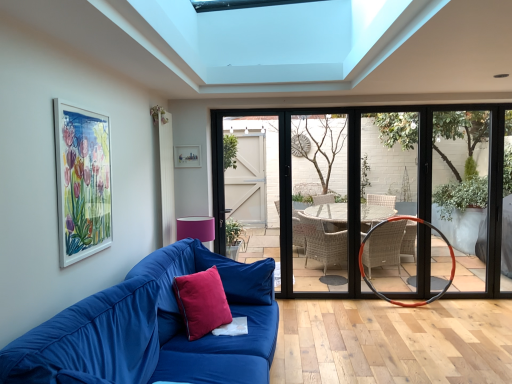
Question: Is velvet blue couch at lower left at the left side of velvet red pillow at lower left, which ranks as the 2th pillow in front-to-back order?

Choices:
 (A) no
 (B) yes

Answer: (B)

Question: Is velvet blue couch at lower left positioned in front of velvet red pillow at lower left, which ranks as the 2th pillow in front-to-back order?

Choices:
 (A) yes
 (B) no

Answer: (A)

Question: Is velvet blue couch at lower left to the right of velvet red pillow at lower left, positioned as the 1th pillow in back-to-front order, from the viewer's perspective?

Choices:
 (A) no
 (B) yes

Answer: (A)

Question: Is velvet blue couch at lower left surrounding velvet red pillow at lower left, which ranks as the 2th pillow in front-to-back order?

Choices:
 (A) yes
 (B) no

Answer: (A)

Question: Considering the relative sizes of velvet blue couch at lower left and velvet red pillow at lower left, positioned as the 1th pillow in back-to-front order, in the image provided, is velvet blue couch at lower left wider than velvet red pillow at lower left, positioned as the 1th pillow in back-to-front order,?

Choices:
 (A) no
 (B) yes

Answer: (B)

Question: Relative to velvet red pillow at lower left, positioned as the 1th pillow in back-to-front order, is satin red pillow at center, acting as the second pillow starting from the back, in front or behind?

Choices:
 (A) front
 (B) behind

Answer: (A)

Question: Is point (196, 306) closer or farther from the camera than point (239, 284)?

Choices:
 (A) closer
 (B) farther

Answer: (A)

Question: From the image's perspective, is satin red pillow at center, acting as the second pillow starting from the back, above or below velvet red pillow at lower left, positioned as the 1th pillow in back-to-front order?

Choices:
 (A) above
 (B) below

Answer: (B)

Question: Which is correct: satin red pillow at center, acting as the second pillow starting from the back, is inside velvet red pillow at lower left, which ranks as the 2th pillow in front-to-back order, or outside of it?

Choices:
 (A) outside
 (B) inside

Answer: (A)

Question: Does point (454, 261) appear closer or farther from the camera than point (189, 321)?

Choices:
 (A) closer
 (B) farther

Answer: (B)

Question: In terms of size, does orange rubber basketball hoop at right appear bigger or smaller than satin red pillow at center, acting as the first pillow starting from the front?

Choices:
 (A) small
 (B) big

Answer: (B)

Question: From their relative heights in the image, would you say orange rubber basketball hoop at right is taller or shorter than satin red pillow at center, acting as the second pillow starting from the back?

Choices:
 (A) tall
 (B) short

Answer: (A)

Question: From a real-world perspective, is orange rubber basketball hoop at right above or below satin red pillow at center, acting as the first pillow starting from the front?

Choices:
 (A) below
 (B) above

Answer: (A)

Question: Looking at their shapes, would you say matte wooden picture frame at upper center, positioned as the second picture frame in front-to-back order, is wider or thinner than satin red pillow at center, acting as the first pillow starting from the front?

Choices:
 (A) wide
 (B) thin

Answer: (B)

Question: From the image's perspective, is matte wooden picture frame at upper center, which is counted as the 1th picture frame, starting from the back, positioned above or below satin red pillow at center, acting as the first pillow starting from the front?

Choices:
 (A) below
 (B) above

Answer: (B)